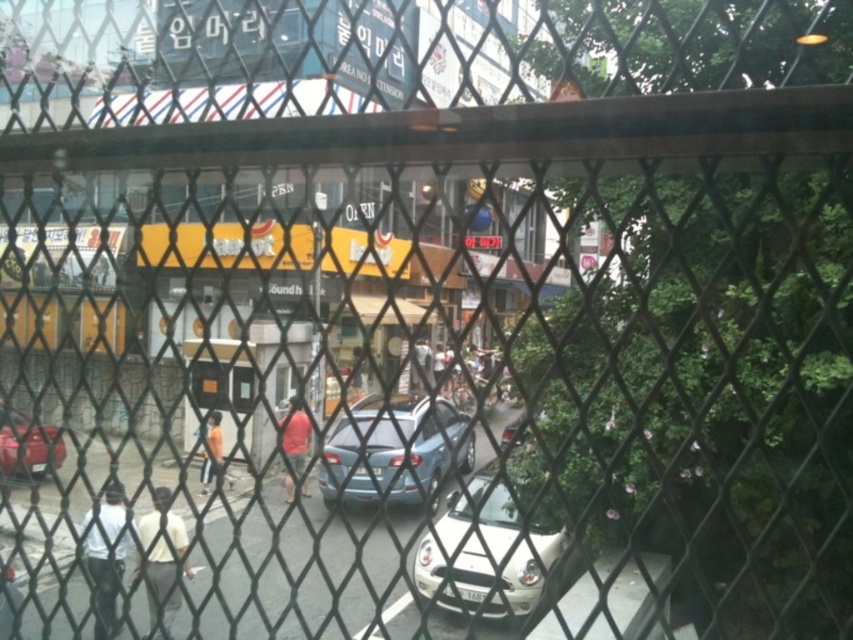
Question: Considering the relative positions of light yellow shirt at lower left and orange fabric pants at center in the image provided, where is light yellow shirt at lower left located with respect to orange fabric pants at center?

Choices:
 (A) left
 (B) right

Answer: (A)

Question: Can you confirm if matte blue sedan at center is positioned above matte red shirt at center?

Choices:
 (A) yes
 (B) no

Answer: (B)

Question: Based on their relative distances, which object is farther from the orange fabric pants at center?

Choices:
 (A) matte red shirt at center
 (B) white matte car at center

Answer: (B)

Question: Which object appears closest to the camera in this image?

Choices:
 (A) matte red car at lower left
 (B) white matte car at center

Answer: (A)

Question: Which object is closer to the camera taking this photo?

Choices:
 (A) white matte car at center
 (B) white matte shirt at lower left
 (C) orange fabric pants at center

Answer: (A)

Question: Is matte blue sedan at center wider than light yellow shirt at lower left?

Choices:
 (A) yes
 (B) no

Answer: (A)